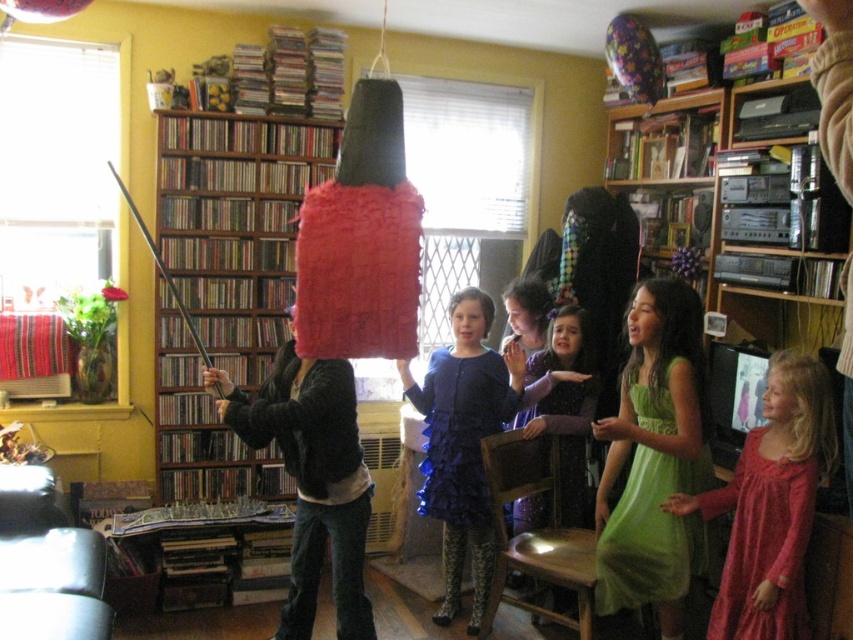
Question: Which of the following is the closest to the observer?

Choices:
 (A) (483, 328)
 (B) (228, 369)
 (C) (554, 605)

Answer: (A)

Question: Which object is the closest to the velvet purple dress at center?

Choices:
 (A) pink satin dress at lower right
 (B) ruffled blue dress at center

Answer: (B)

Question: Considering the relative positions of green tulle dress at lower right and velvet purple dress at center in the image provided, where is green tulle dress at lower right located with respect to velvet purple dress at center?

Choices:
 (A) left
 (B) right

Answer: (B)

Question: Can you confirm if wooden bookshelf at left is thinner than green tulle dress at lower right?

Choices:
 (A) no
 (B) yes

Answer: (A)

Question: Considering the real-world distances, which object is closest to the velvet purple dress at center?

Choices:
 (A) pink satin dress at lower right
 (B) wooden bookshelf at left

Answer: (A)

Question: Does green tulle dress at lower right appear on the right side of velvet purple dress at center?

Choices:
 (A) yes
 (B) no

Answer: (A)